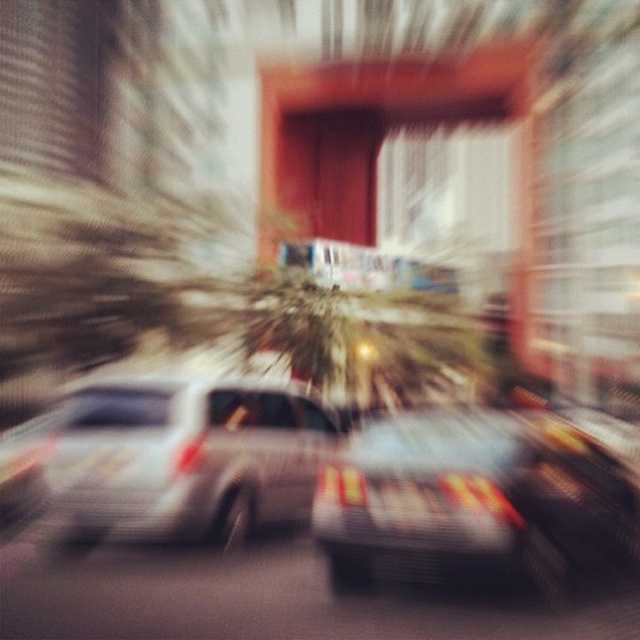
Question: Is metallic silver car at center smaller than metallic gray car at center?

Choices:
 (A) yes
 (B) no

Answer: (B)

Question: Can you confirm if metallic silver car at center is positioned above metallic gray car at center?

Choices:
 (A) yes
 (B) no

Answer: (A)

Question: Does metallic silver car at center appear over metallic gray car at center?

Choices:
 (A) yes
 (B) no

Answer: (A)

Question: Which point is closer to the camera?

Choices:
 (A) (365, 568)
 (B) (109, 422)

Answer: (A)